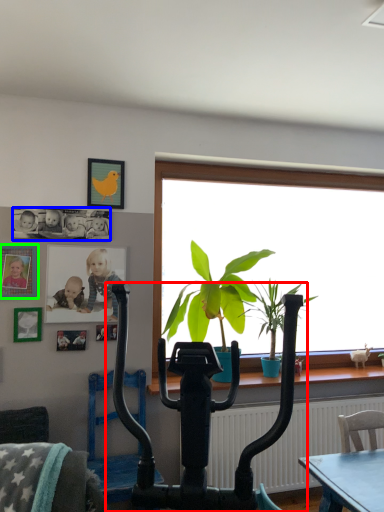
Question: Which is nearer to the vacuum (highlighted by a red box)? art (highlighted by a blue box) or picture frame (highlighted by a green box).

Choices:
 (A) art
 (B) picture frame

Answer: (B)